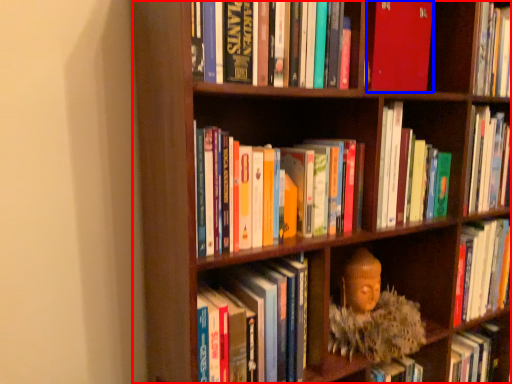
Question: Which point is closer to the camera, bookcase (highlighted by a red box) or book (highlighted by a blue box)?

Choices:
 (A) bookcase
 (B) book

Answer: (A)